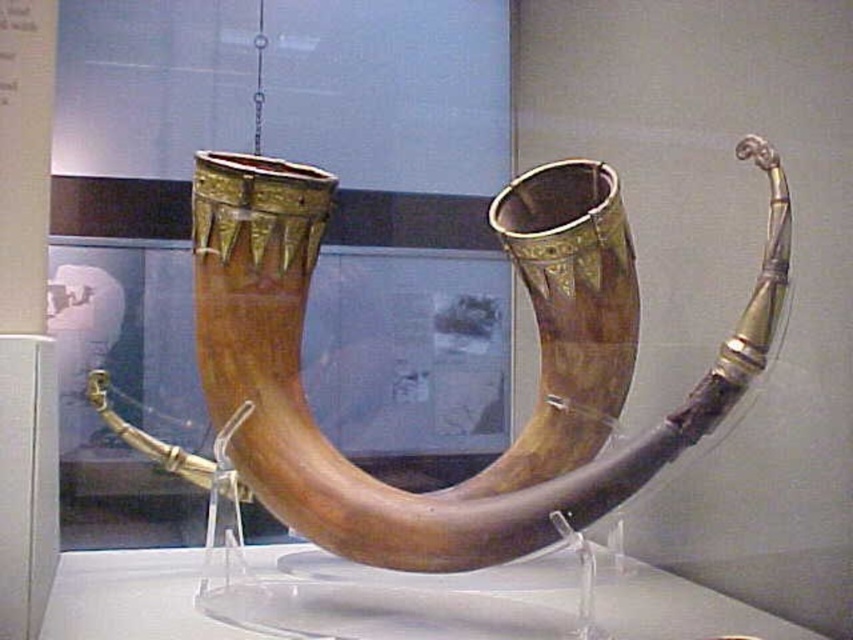
In the scene shown: Between polished wood horn at center and transparent acrylic table at center, which one appears on the left side from the viewer's perspective?

transparent acrylic table at center

Is point (581, 454) closer to camera compared to point (154, 589)?

No.

The height and width of the screenshot is (640, 853). In order to click on polished wood horn at center in this screenshot , I will do `click(541, 362)`.